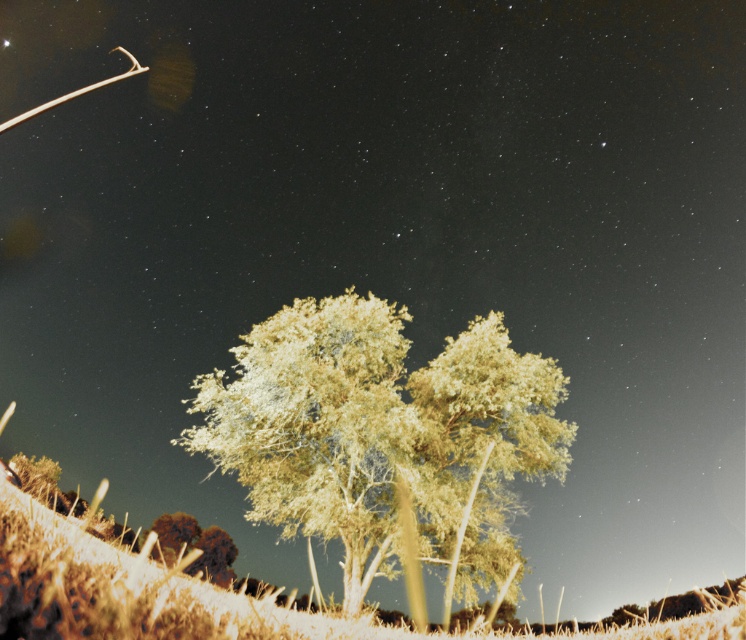
Does green leafy tree at center have a lesser width compared to brown fuzzy bush at lower left?

Incorrect, green leafy tree at center's width is not less than brown fuzzy bush at lower left's.

Who is more forward, (313, 458) or (195, 563)?

Positioned in front is point (313, 458).

The width and height of the screenshot is (746, 640). I want to click on green leafy tree at center, so click(x=383, y=436).